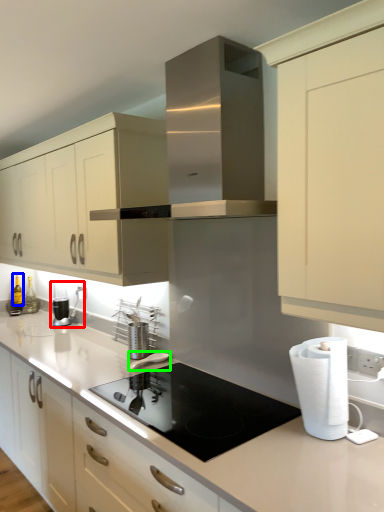
Question: Considering the real-world distances, which object is farthest from coffee machine (highlighted by a red box)? bottle (highlighted by a blue box) or appliance (highlighted by a green box)?

Choices:
 (A) bottle
 (B) appliance

Answer: (B)